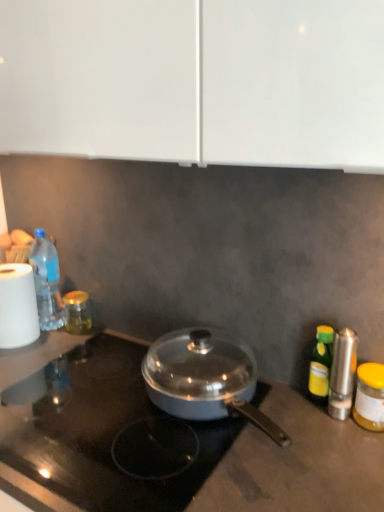
The width and height of the screenshot is (384, 512). Describe the element at coordinates (77, 312) in the screenshot. I see `gold glass jar at left, which ranks as the 1th bottle in back-to-front order` at that location.

The height and width of the screenshot is (512, 384). Identify the location of yellow matte jar at right, the 1th bottle from the right. (370, 396).

Locate an element on the screen. The height and width of the screenshot is (512, 384). green glass bottle at right, the 3th bottle positioned from the back is located at coordinates (321, 364).

Considering the relative sizes of silver metallic salt shaker at right and metallic gray pan at center in the image provided, is silver metallic salt shaker at right bigger than metallic gray pan at center?

Actually, silver metallic salt shaker at right might be smaller than metallic gray pan at center.

From a real-world perspective, is silver metallic salt shaker at right physically below metallic gray pan at center?

Incorrect, from a real-world perspective, silver metallic salt shaker at right is higher than metallic gray pan at center.

Is point (339, 415) closer to viewer compared to point (271, 461)?

No, (339, 415) is behind (271, 461).

Can you confirm if silver metallic salt shaker at right is shorter than metallic gray pan at center?

Yes.

Is yellow matte jar at right, which ranks as the fourth bottle in back-to-front order, positioned beyond the bounds of green glass bottle at right, which is the 2th bottle in front-to-back order?

Absolutely, yellow matte jar at right, which ranks as the fourth bottle in back-to-front order, is external to green glass bottle at right, which is the 2th bottle in front-to-back order.

Is yellow matte jar at right, the first bottle from the front, looking in the opposite direction of green glass bottle at right, which is the 2th bottle in front-to-back order?

No, yellow matte jar at right, the first bottle from the front, is not facing away from green glass bottle at right, which is the 2th bottle in front-to-back order.

Is point (375, 365) positioned behind point (319, 384)?

That is False.

From the image's perspective, is gold glass jar at left, the 4th bottle from the front, on top of metallic gray pan at center?

Yes, from the image's perspective, gold glass jar at left, the 4th bottle from the front, is on top of metallic gray pan at center.

Based on their positions, is gold glass jar at left, which ranks as the 3th bottle in right-to-left order, located to the left or right of metallic gray pan at center?

In the image, gold glass jar at left, which ranks as the 3th bottle in right-to-left order, appears on the left side of metallic gray pan at center.

You are a GUI agent. You are given a task and a screenshot of the screen. Output one action in this format:
    pyautogui.click(x=<x>, y=<y>)
    Task: Click on the gas stove on the right of gold glass jar at left, the 4th bottle from the front
    
    Given the screenshot: What is the action you would take?
    pyautogui.click(x=198, y=454)

Between white matte paper towel at left and metallic gray pan at center, which one has smaller size?

With smaller size is white matte paper towel at left.

From a real-world perspective, is white matte paper towel at left located beneath metallic gray pan at center?

Incorrect, from a real-world perspective, white matte paper towel at left is higher than metallic gray pan at center.

Is white matte paper towel at left aimed at metallic gray pan at center?

No, white matte paper towel at left does not turn towards metallic gray pan at center.

Which is correct: translucent plastic bottle at left, which ranks as the third bottle in front-to-back order, is inside silver metallic salt shaker at right, or outside of it?

translucent plastic bottle at left, which ranks as the third bottle in front-to-back order, exists outside the volume of silver metallic salt shaker at right.

Which bottle is the 3rd one when counting from the left side of the silver metallic salt shaker at right? Please provide its 2D coordinates.

[(47, 282)]

Does translucent plastic bottle at left, positioned as the 4th bottle in right-to-left order, have a greater width compared to silver metallic salt shaker at right?

Indeed, translucent plastic bottle at left, positioned as the 4th bottle in right-to-left order, has a greater width compared to silver metallic salt shaker at right.

Considering the sizes of translucent plastic bottle at left, positioned as the 4th bottle in right-to-left order, and silver metallic salt shaker at right in the image, is translucent plastic bottle at left, positioned as the 4th bottle in right-to-left order, bigger or smaller than silver metallic salt shaker at right?

translucent plastic bottle at left, positioned as the 4th bottle in right-to-left order, is bigger than silver metallic salt shaker at right.

Which of these two, green glass bottle at right, the 3th bottle positioned from the back, or gold glass jar at left, which ranks as the 3th bottle in right-to-left order, stands taller?

Standing taller between the two is green glass bottle at right, the 3th bottle positioned from the back.

Between point (330, 340) and point (78, 330), which one is positioned behind?

The point (78, 330) is behind.

Considering the sizes of objects green glass bottle at right, the 3th bottle positioned from the back, and gold glass jar at left, the 4th bottle from the front, in the image provided, who is smaller, green glass bottle at right, the 3th bottle positioned from the back, or gold glass jar at left, the 4th bottle from the front,?

green glass bottle at right, the 3th bottle positioned from the back, is smaller.

From a real-world perspective, is green glass bottle at right, which is the 2th bottle in front-to-back order, below gold glass jar at left, which ranks as the 1th bottle in back-to-front order?

No.

You are a GUI agent. You are given a task and a screenshot of the screen. Output one action in this format:
    pyautogui.click(x=<x>, y=<y>)
    Task: Click on the appliance that is in front of the gold glass jar at left, which ranks as the second bottle in left-to-right order
    This screenshot has width=384, height=512.
    Given the screenshot: What is the action you would take?
    pyautogui.click(x=342, y=373)

Is silver metallic salt shaker at right far from gold glass jar at left, which ranks as the second bottle in left-to-right order?

No, silver metallic salt shaker at right is not far from gold glass jar at left, which ranks as the second bottle in left-to-right order.

Is silver metallic salt shaker at right behind gold glass jar at left, which ranks as the second bottle in left-to-right order?

No, silver metallic salt shaker at right is closer to the camera.

From the image's perspective, would you say silver metallic salt shaker at right is shown under gold glass jar at left, which ranks as the 1th bottle in back-to-front order?

Indeed, from the image's perspective, silver metallic salt shaker at right is shown beneath gold glass jar at left, which ranks as the 1th bottle in back-to-front order.

The image size is (384, 512). Find the location of `appliance on the right side of metallic gray pan at center`. appliance on the right side of metallic gray pan at center is located at coordinates (342, 373).

In order to click on bottle that is the 1st object located above the yellow matte jar at right, positioned as the fourth bottle in left-to-right order (from the image's perspective) in this screenshot , I will do `click(321, 364)`.

When comparing their distances from metallic gray pan at center, does silver metallic salt shaker at right or gold glass jar at left, which ranks as the 3th bottle in right-to-left order, seem further?

gold glass jar at left, which ranks as the 3th bottle in right-to-left order, is further to metallic gray pan at center.

From the image, which object appears to be farther from silver metallic salt shaker at right, yellow matte jar at right, the first bottle from the front, or gold glass jar at left, the 4th bottle from the front?

Based on the image, gold glass jar at left, the 4th bottle from the front, appears to be further to silver metallic salt shaker at right.

Which object lies further to the anchor point metallic gray pan at center, white matte paper towel at left or silver metallic salt shaker at right?

Based on the image, white matte paper towel at left appears to be further to metallic gray pan at center.

Considering their positions, is metallic gray pan at center positioned further to white matte paper towel at left than green glass bottle at right, the third bottle from the left?

green glass bottle at right, the third bottle from the left.

Looking at the image, which one is located closer to white matte paper towel at left, translucent plastic bottle at left, which ranks as the third bottle in front-to-back order, or green glass bottle at right, marked as the second bottle in a right-to-left arrangement?

Among the two, translucent plastic bottle at left, which ranks as the third bottle in front-to-back order, is located nearer to white matte paper towel at left.

When comparing their distances from silver metallic salt shaker at right, does gold glass jar at left, which ranks as the second bottle in left-to-right order, or green glass bottle at right, which is the 2th bottle in front-to-back order, seem further?

gold glass jar at left, which ranks as the second bottle in left-to-right order, is positioned further to the anchor silver metallic salt shaker at right.

Which object lies nearer to the anchor point metallic gray pan at center, silver metallic salt shaker at right or green glass bottle at right, the third bottle from the left?

Based on the image, silver metallic salt shaker at right appears to be nearer to metallic gray pan at center.

Considering their positions, is metallic gray pan at center positioned closer to translucent plastic bottle at left, positioned as the 2th bottle in back-to-front order, than gold glass jar at left, which ranks as the 1th bottle in back-to-front order?

Among the two, gold glass jar at left, which ranks as the 1th bottle in back-to-front order, is located nearer to translucent plastic bottle at left, positioned as the 2th bottle in back-to-front order.

The width and height of the screenshot is (384, 512). What are the coordinates of `gas stove between gold glass jar at left, which ranks as the 1th bottle in back-to-front order, and yellow matte jar at right, positioned as the fourth bottle in left-to-right order, in the horizontal direction` in the screenshot? It's located at (198, 454).

The width and height of the screenshot is (384, 512). What are the coordinates of `bottle between gold glass jar at left, which ranks as the 3th bottle in right-to-left order, and yellow matte jar at right, positioned as the fourth bottle in left-to-right order` in the screenshot? It's located at (321, 364).

Where is `paper towel positioned between metallic gray pan at center and gold glass jar at left, which ranks as the 1th bottle in back-to-front order, from near to far`? The height and width of the screenshot is (512, 384). paper towel positioned between metallic gray pan at center and gold glass jar at left, which ranks as the 1th bottle in back-to-front order, from near to far is located at coordinates (17, 306).

Locate an element on the screen. appliance positioned between metallic gray pan at center and gold glass jar at left, which ranks as the 3th bottle in right-to-left order, from near to far is located at coordinates (342, 373).